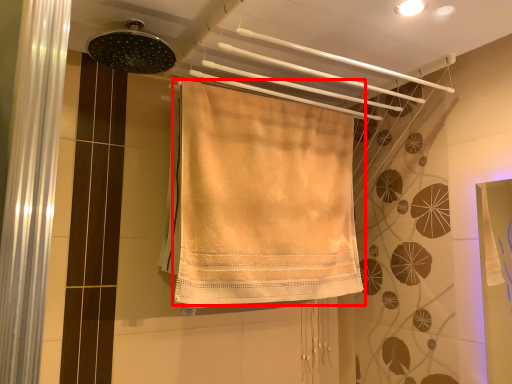
Question: From the image's perspective, what is the correct spatial relationship of towel (annotated by the red box) in relation to shower?

Choices:
 (A) below
 (B) above

Answer: (A)